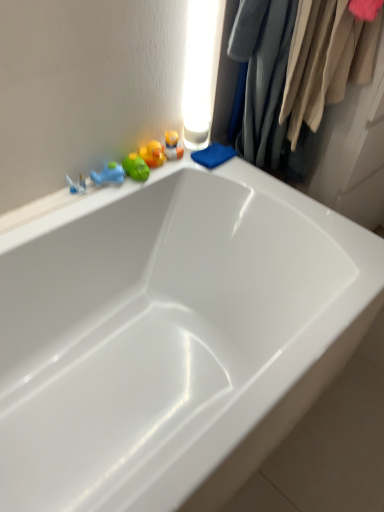
What is the approximate height of rubber duck at upper left, the second toy viewed from the right?

2.68 inches.

At what (x,y) coordinates should I click in order to perform the action: click on translucent plastic toys at upper left, acting as the 3th toy starting from the left. Please return your answer as a coordinate pair (x, y). The width and height of the screenshot is (384, 512). Looking at the image, I should click on (172, 146).

The height and width of the screenshot is (512, 384). Describe the element at coordinates (305, 93) in the screenshot. I see `velvet fabric clothes at upper right` at that location.

In order to face velvet fabric clothes at upper right, should I rotate leftwards or rightwards?

Turn right by 11.496 degrees to look at velvet fabric clothes at upper right.

This screenshot has height=512, width=384. Describe the element at coordinates (136, 167) in the screenshot. I see `green rubber duck at upper left, which is the first toy from left to right` at that location.

What is the approximate height of green rubber duck at upper left, the third toy positioned from the right?

green rubber duck at upper left, the third toy positioned from the right, is 2.04 inches in height.

Identify the location of rubber duck at upper left, the second toy viewed from the right. The height and width of the screenshot is (512, 384). (152, 154).

From a real-world perspective, which is physically above, velvet fabric clothes at upper right or white glossy bathtub at upper center?

velvet fabric clothes at upper right is physically above.

Where is `closet that appears on the right of white glossy bathtub at upper center`? closet that appears on the right of white glossy bathtub at upper center is located at coordinates (305, 93).

Does velvet fabric clothes at upper right turn towards white glossy bathtub at upper center?

Yes, velvet fabric clothes at upper right is turned towards white glossy bathtub at upper center.

Between velvet fabric clothes at upper right and white glossy bathtub at upper center, which one appears on the left side from the viewer's perspective?

Positioned to the left is white glossy bathtub at upper center.

Which of these two, green rubber duck at upper left, which is the first toy from left to right, or translucent plastic toys at upper left, the 1th toy viewed from the right, stands taller?

With more height is translucent plastic toys at upper left, the 1th toy viewed from the right.

Does point (141, 167) appear closer or farther from the camera than point (174, 135)?

Point (141, 167) appears to be closer to the viewer than point (174, 135).

From a real-world perspective, which object rests below the other?

green rubber duck at upper left, the third toy positioned from the right, is physically lower.

Measure the distance between green rubber duck at upper left, which is the first toy from left to right, and translucent plastic toys at upper left, the 1th toy viewed from the right.

They are 5.12 inches apart.

Does white glossy bathtub at upper center have a smaller size compared to velvet fabric clothes at upper right?

No.

Do you think white glossy bathtub at upper center is within velvet fabric clothes at upper right, or outside of it?

white glossy bathtub at upper center lies outside velvet fabric clothes at upper right.

Does point (321, 272) appear closer or farther from the camera than point (334, 71)?

Point (321, 272) is closer to the camera than point (334, 71).

Considering the relative sizes of velvet fabric clothes at upper right and translucent plastic toys at upper left, the 1th toy viewed from the right, in the image provided, is velvet fabric clothes at upper right thinner than translucent plastic toys at upper left, the 1th toy viewed from the right,?

No, velvet fabric clothes at upper right is not thinner than translucent plastic toys at upper left, the 1th toy viewed from the right.

Considering the positions of point (241, 128) and point (167, 131), is point (241, 128) closer or farther from the camera than point (167, 131)?

Point (241, 128) is farther from the camera than point (167, 131).

Is velvet fabric clothes at upper right positioned before translucent plastic toys at upper left, the 1th toy viewed from the right?

Yes, velvet fabric clothes at upper right is closer to the viewer.

Who is shorter, velvet fabric clothes at upper right or translucent plastic toys at upper left, the 1th toy viewed from the right?

translucent plastic toys at upper left, the 1th toy viewed from the right.

Which object is closer to the camera, rubber duck at upper left, which is the second toy from left to right, or velvet fabric clothes at upper right?

Positioned in front is velvet fabric clothes at upper right.

Is point (161, 150) less distant than point (292, 173)?

Yes, it is.

In order to click on closet that appears above the rubber duck at upper left, the second toy viewed from the right (from a real-world perspective) in this screenshot , I will do `click(305, 93)`.

Consider the image. Is rubber duck at upper left, the second toy viewed from the right, far from velvet fabric clothes at upper right?

rubber duck at upper left, the second toy viewed from the right, is near velvet fabric clothes at upper right, not far away.

Can you tell me how much translucent plastic toys at upper left, the 1th toy viewed from the right, and white glossy bathtub at upper center differ in facing direction?

The facing directions of translucent plastic toys at upper left, the 1th toy viewed from the right, and white glossy bathtub at upper center are 0.234 degrees apart.

In the scene shown: Is translucent plastic toys at upper left, acting as the 3th toy starting from the left, bigger than white glossy bathtub at upper center?

Actually, translucent plastic toys at upper left, acting as the 3th toy starting from the left, might be smaller than white glossy bathtub at upper center.

Considering the positions of objects translucent plastic toys at upper left, acting as the 3th toy starting from the left, and white glossy bathtub at upper center in the image provided, who is in front, translucent plastic toys at upper left, acting as the 3th toy starting from the left, or white glossy bathtub at upper center?

white glossy bathtub at upper center is in front.

Would you say translucent plastic toys at upper left, the 1th toy viewed from the right, is to the left or to the right of white glossy bathtub at upper center in the picture?

Clearly, translucent plastic toys at upper left, the 1th toy viewed from the right, is on the right of white glossy bathtub at upper center in the image.

Between velvet fabric clothes at upper right and rubber duck at upper left, which is the second toy from left to right, which one has more height?

Standing taller between the two is velvet fabric clothes at upper right.

Which of these two, velvet fabric clothes at upper right or rubber duck at upper left, which is the second toy from left to right, is wider?

velvet fabric clothes at upper right is wider.

Can you tell me how much velvet fabric clothes at upper right and rubber duck at upper left, the second toy viewed from the right, differ in facing direction?

The angle between the facing direction of velvet fabric clothes at upper right and the facing direction of rubber duck at upper left, the second toy viewed from the right, is 88.5 degrees.

Considering the relative positions of velvet fabric clothes at upper right and rubber duck at upper left, the second toy viewed from the right, in the image provided, is velvet fabric clothes at upper right to the left of rubber duck at upper left, the second toy viewed from the right, from the viewer's perspective?

No.

At what (x,y) coordinates should I click in order to perform the action: click on bathtub below the velvet fabric clothes at upper right (from the image's perspective). Please return your answer as a coordinate pair (x, y). The width and height of the screenshot is (384, 512). Looking at the image, I should click on (x=170, y=335).

The width and height of the screenshot is (384, 512). I want to click on the 2nd toy above when counting from the green rubber duck at upper left, the third toy positioned from the right (from the image's perspective), so click(x=172, y=146).

From the image, which object appears to be nearer to velvet fabric clothes at upper right, translucent plastic toys at upper left, acting as the 3th toy starting from the left, or rubber duck at upper left, which is the second toy from left to right?

translucent plastic toys at upper left, acting as the 3th toy starting from the left, lies closer to velvet fabric clothes at upper right than the other object.

Looking at the image, which one is located further to velvet fabric clothes at upper right, rubber duck at upper left, which is the second toy from left to right, or white glossy bathtub at upper center?

white glossy bathtub at upper center is further to velvet fabric clothes at upper right.

Estimate the real-world distances between objects in this image. Which object is closer to white glossy bathtub at upper center, green rubber duck at upper left, which is the first toy from left to right, or rubber duck at upper left, which is the second toy from left to right?

Based on the image, green rubber duck at upper left, which is the first toy from left to right, appears to be nearer to white glossy bathtub at upper center.

From the image, which object appears to be farther from white glossy bathtub at upper center, rubber duck at upper left, the second toy viewed from the right, or velvet fabric clothes at upper right?

The object further to white glossy bathtub at upper center is rubber duck at upper left, the second toy viewed from the right.

Estimate the real-world distances between objects in this image. Which object is closer to translucent plastic toys at upper left, the 1th toy viewed from the right, rubber duck at upper left, which is the second toy from left to right, or white glossy bathtub at upper center?

Among the two, rubber duck at upper left, which is the second toy from left to right, is located nearer to translucent plastic toys at upper left, the 1th toy viewed from the right.

Estimate the real-world distances between objects in this image. Which object is closer to rubber duck at upper left, the second toy viewed from the right, translucent plastic toys at upper left, the 1th toy viewed from the right, or velvet fabric clothes at upper right?

translucent plastic toys at upper left, the 1th toy viewed from the right, is positioned closer to the anchor rubber duck at upper left, the second toy viewed from the right.

Based on their spatial positions, is green rubber duck at upper left, which is the first toy from left to right, or velvet fabric clothes at upper right closer to white glossy bathtub at upper center?

green rubber duck at upper left, which is the first toy from left to right.

From the image, which object appears to be nearer to green rubber duck at upper left, which is the first toy from left to right, rubber duck at upper left, the second toy viewed from the right, or translucent plastic toys at upper left, acting as the 3th toy starting from the left?

Among the two, rubber duck at upper left, the second toy viewed from the right, is located nearer to green rubber duck at upper left, which is the first toy from left to right.

Find the location of a particular element. The width and height of the screenshot is (384, 512). toy between green rubber duck at upper left, which is the first toy from left to right, and translucent plastic toys at upper left, the 1th toy viewed from the right is located at coordinates (152, 154).

Where is `closet between white glossy bathtub at upper center and translucent plastic toys at upper left, acting as the 3th toy starting from the left, from front to back`? closet between white glossy bathtub at upper center and translucent plastic toys at upper left, acting as the 3th toy starting from the left, from front to back is located at coordinates (305, 93).

Where is `toy between white glossy bathtub at upper center and rubber duck at upper left, which is the second toy from left to right, in the front-back direction`? This screenshot has width=384, height=512. toy between white glossy bathtub at upper center and rubber duck at upper left, which is the second toy from left to right, in the front-back direction is located at coordinates (136, 167).